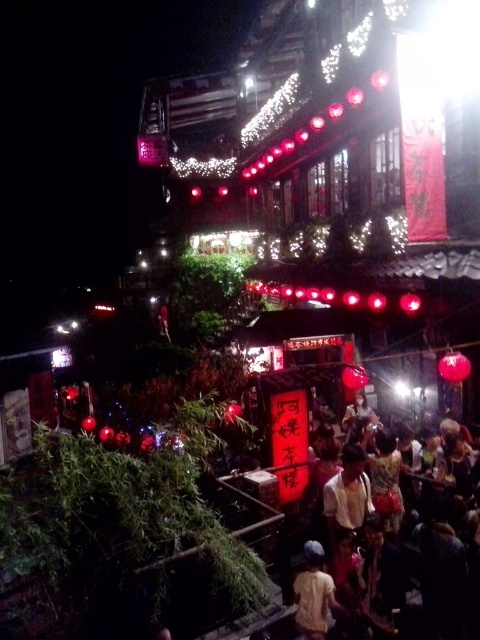
In the scene shown: You are standing at the entrance of the market and see the matte black crowd at lower center and the light yellow fabric at center. Which object is positioned to the right side from your perspective?

The matte black crowd at lower center is to the right of light yellow fabric at center, so the matte black crowd at lower center is positioned to the right side from your perspective.

You are a street performer carrying a 1.5 meter long pole. You need to move from the matte black crowd at lower center to the light yellow fabric at center. Can you pass through the space between them without tilting the pole?

The distance between the matte black crowd at lower center and the light yellow fabric at center is 1.64 meters. Since the pole is 1.5 meters long, you can pass through the space between them without tilting the pole as the distance is sufficient.

You are standing at the entrance of the market and see the matte black crowd at lower center and the light yellow fabric at center. Which object is nearer to you?

The matte black crowd at lower center is closer to the viewer than the light yellow fabric at center.